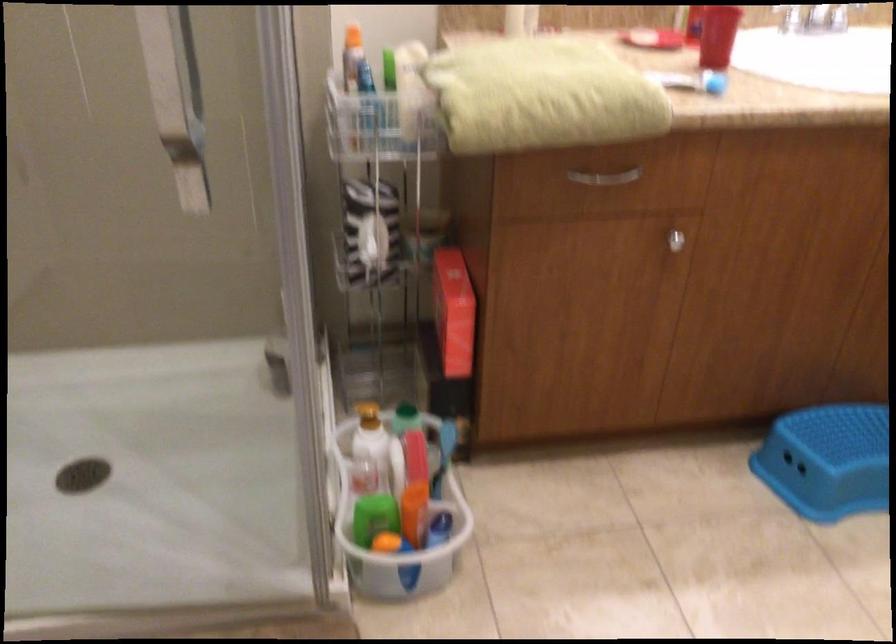
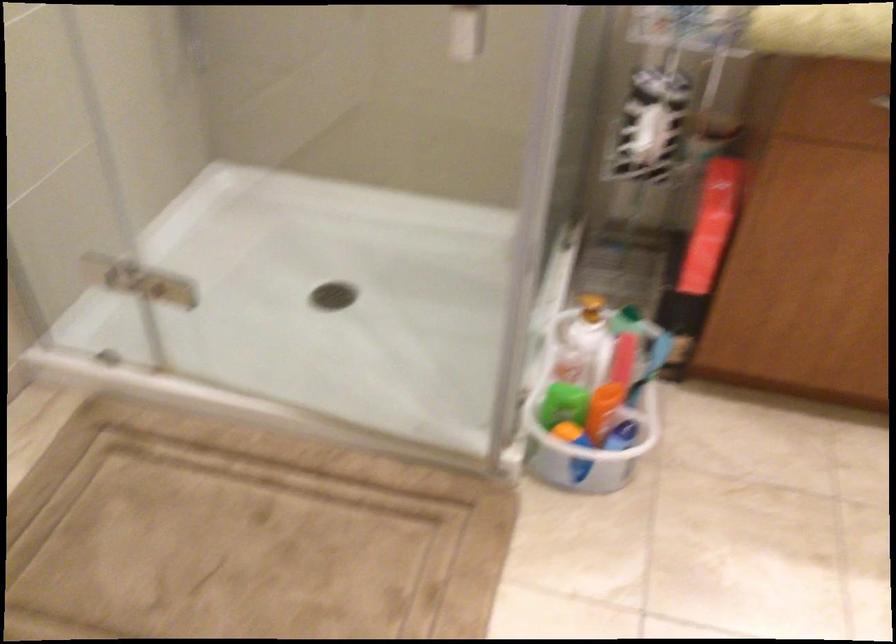
The point at (420, 498) is marked in the first image. Where is the corresponding point in the second image?

(610, 393)